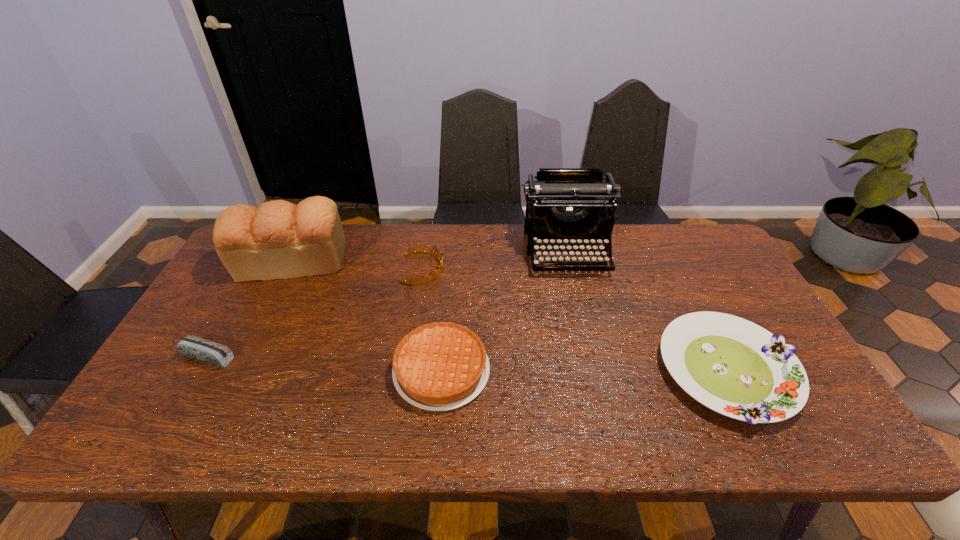
Where is `the second object from right to left`? the second object from right to left is located at coordinates (564, 203).

Locate an element on the screen. bread is located at coordinates (279, 240).

In order to click on the third tallest object in this screenshot , I will do `click(415, 250)`.

What are the coordinates of `pie` in the screenshot? It's located at click(x=439, y=366).

You are a GUI agent. You are given a task and a screenshot of the screen. Output one action in this format:
    pyautogui.click(x=<x>, y=<y>)
    Task: Click on the pencil box
    This screenshot has height=540, width=960.
    Given the screenshot: What is the action you would take?
    pyautogui.click(x=210, y=352)

Find the location of `the rightmost object`. the rightmost object is located at coordinates (735, 367).

Where is `blank space located 0.170m on the typing side of the typewriter`? The width and height of the screenshot is (960, 540). blank space located 0.170m on the typing side of the typewriter is located at coordinates (582, 318).

Where is `vacant space located 0.070m on the right of the bread`? The height and width of the screenshot is (540, 960). vacant space located 0.070m on the right of the bread is located at coordinates (370, 262).

At what (x,y) coordinates should I click in order to perform the action: click on free space located on the front-facing side of the tiara. Please return your answer as a coordinate pair (x, y). Looking at the image, I should click on (509, 268).

Identify the location of vacant space located on the back of the pie. [447, 295].